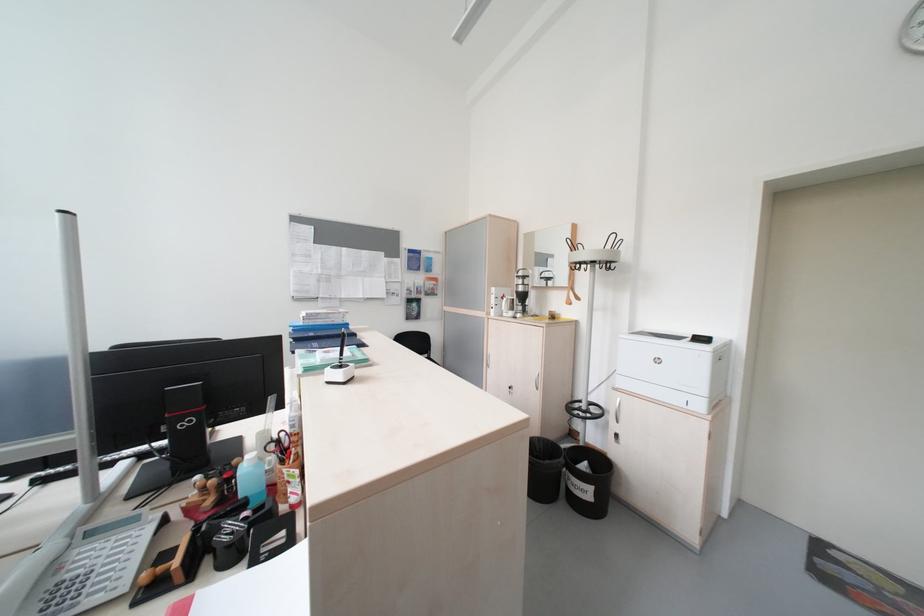
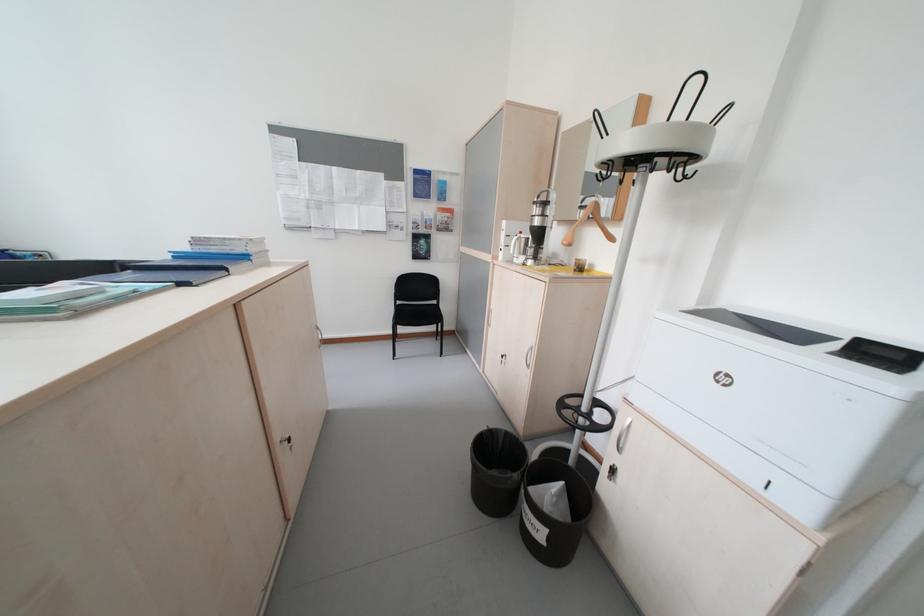
The images are taken continuously from a first-person perspective. In which direction are you moving?

The cameraman moved toward right, forward.